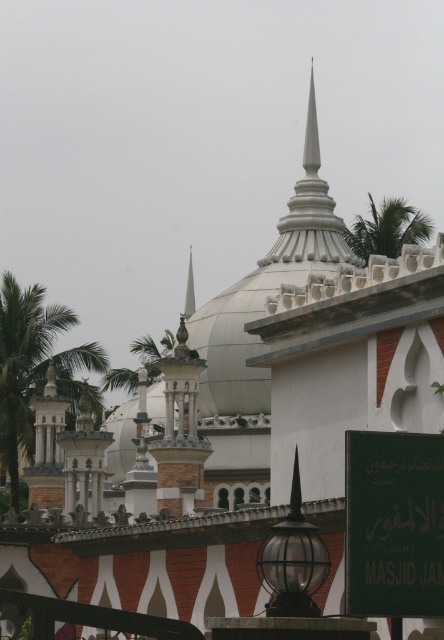
Which is above, green leafy palm tree at left or green leafy palm tree at upper right?

green leafy palm tree at upper right is above.

Who is taller, green leafy palm tree at left or green leafy palm tree at upper right?

With more height is green leafy palm tree at left.

Is point (34, 368) positioned in front of point (364, 234)?

No, (34, 368) is further to viewer.

Identify the location of green leafy palm tree at left. The image size is (444, 640). (32, 365).

Can you confirm if white glossy spire at center is positioned above green leafy palm tree at upper right?

Indeed, white glossy spire at center is positioned over green leafy palm tree at upper right.

Is white glossy spire at center smaller than green leafy palm tree at upper right?

No, white glossy spire at center is not smaller than green leafy palm tree at upper right.

Between point (313, 125) and point (372, 241), which one is positioned in front?

Point (372, 241)

In order to click on white glossy spire at center in this screenshot , I will do `click(310, 211)`.

Which is more to the left, green leafy palm tree at left or white glossy spire at center?

green leafy palm tree at left is more to the left.

Who is taller, green leafy palm tree at left or white glossy spire at center?

Standing taller between the two is white glossy spire at center.

At what (x,y) coordinates should I click in order to perform the action: click on green leafy palm tree at left. Please return your answer as a coordinate pair (x, y). Image resolution: width=444 pixels, height=640 pixels. Looking at the image, I should click on (32, 365).